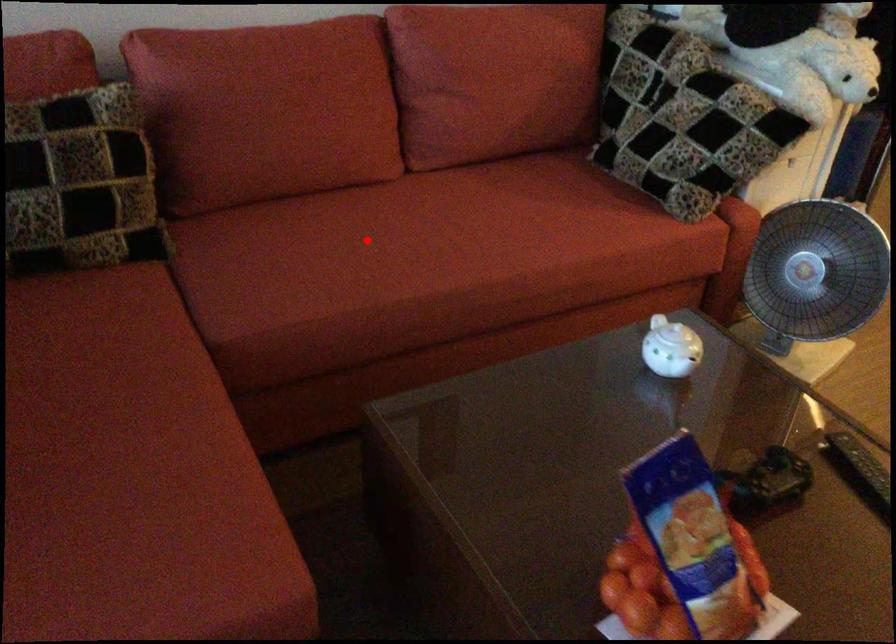
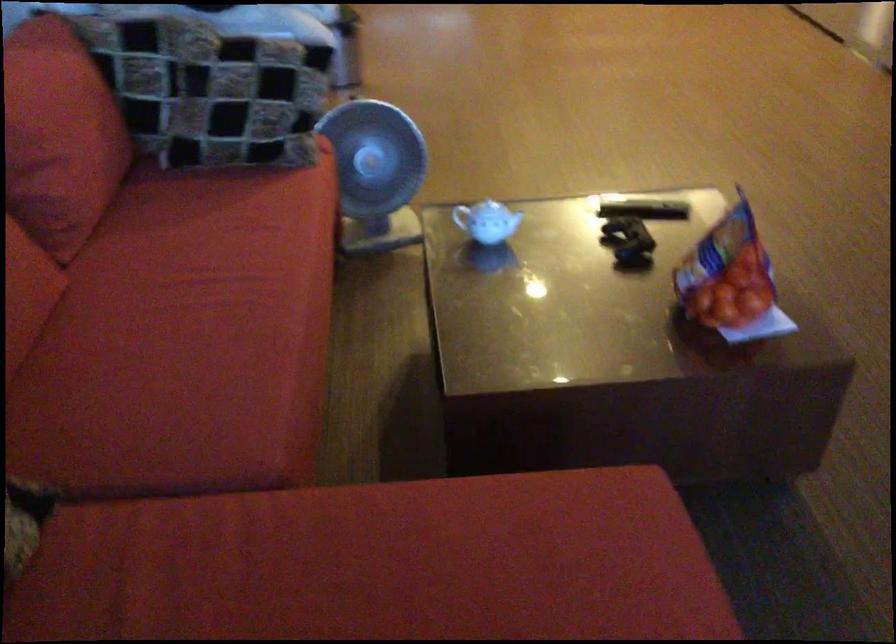
Find the pixel in the second image that matches the highlighted location in the first image.

(192, 330)